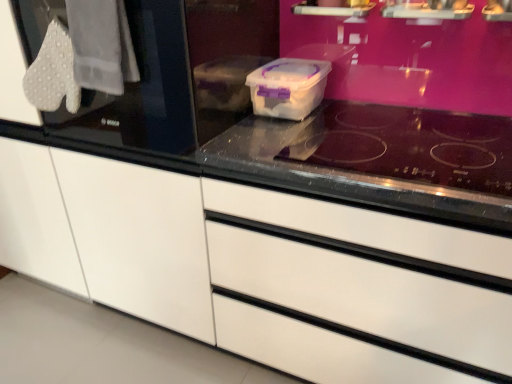
Question: Considering the relative positions of white textured gloves at upper left and transparent glass door at left in the image provided, is white textured gloves at upper left to the left or to the right of transparent glass door at left?

Choices:
 (A) right
 (B) left

Answer: (B)

Question: Choose the correct answer: Is white textured gloves at upper left inside transparent glass door at left or outside it?

Choices:
 (A) outside
 (B) inside

Answer: (B)

Question: Which of these objects is positioned farthest from the transparent glass door at left?

Choices:
 (A) transparent glass at center
 (B) white glossy drawer at center
 (C) white textured gloves at upper left
 (D) transparent plastic container at center

Answer: (A)

Question: Based on their relative distances, which object is farther from the white textured gloves at upper left?

Choices:
 (A) transparent glass door at left
 (B) white glossy drawer at center
 (C) transparent glass at center
 (D) transparent plastic container at center

Answer: (B)